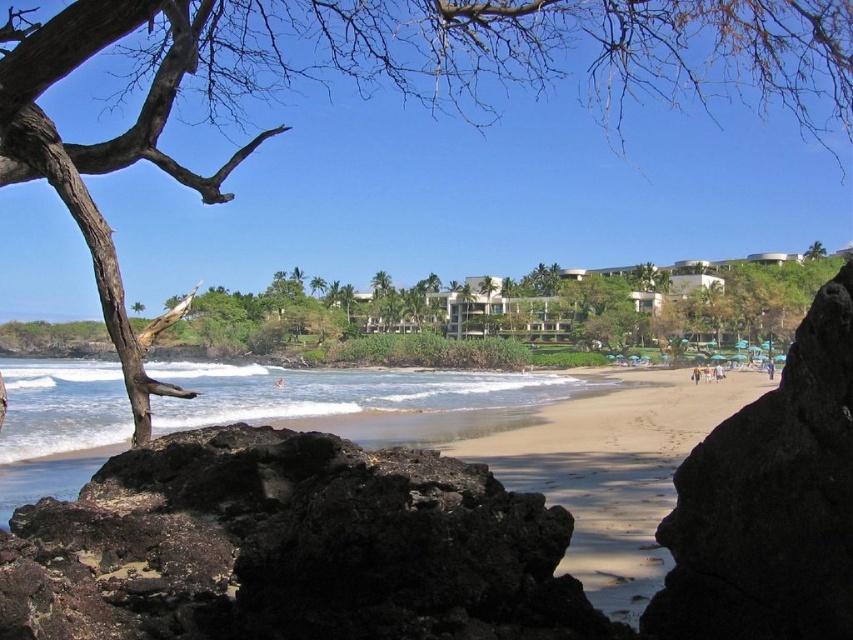
Is the position of brown bark tree at upper left less distant than that of black volcanic rock at center?

No.

Is brown bark tree at upper left positioned behind black volcanic rock at center?

Yes, it is.

Which is behind, point (512, 10) or point (680, 516)?

The point (512, 10) is behind.

Find the location of a particular element. This screenshot has width=853, height=640. brown bark tree at upper left is located at coordinates (386, 80).

Between black volcanic rock at center and light brown sandy beach at center, which one appears on the right side from the viewer's perspective?

From the viewer's perspective, light brown sandy beach at center appears more on the right side.

Between point (793, 550) and point (596, 513), which one is positioned behind?

The point (596, 513) is behind.

I want to click on black volcanic rock at center, so click(x=769, y=502).

Is the position of brown bark tree at upper left more distant than that of light brown sandy beach at center?

Yes, it is behind light brown sandy beach at center.

Who is positioned more to the left, brown bark tree at upper left or light brown sandy beach at center?

brown bark tree at upper left is more to the left.

Which is behind, point (160, 161) or point (622, 595)?

Positioned behind is point (160, 161).

Locate an element on the screen. brown bark tree at upper left is located at coordinates (386, 80).